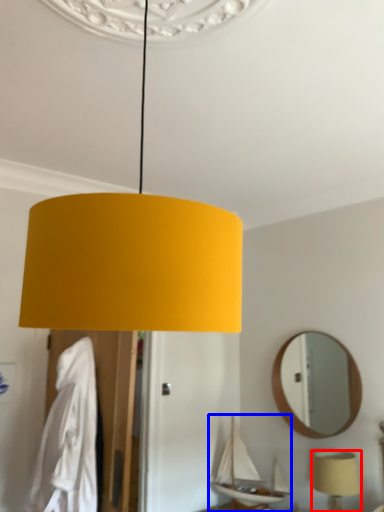
Question: Among these objects, which one is farthest to the camera, lamp (highlighted by a red box) or boat (highlighted by a blue box)?

Choices:
 (A) lamp
 (B) boat

Answer: (B)